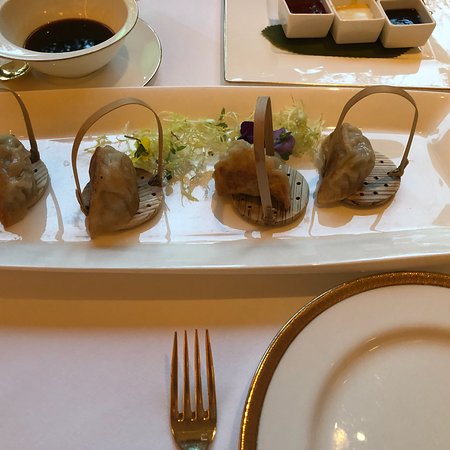
At what (x,y) coordinates should I click in order to perform the action: click on plate. Please return your answer as a coordinate pair (x, y). The image size is (450, 450). Looking at the image, I should click on (369, 395).